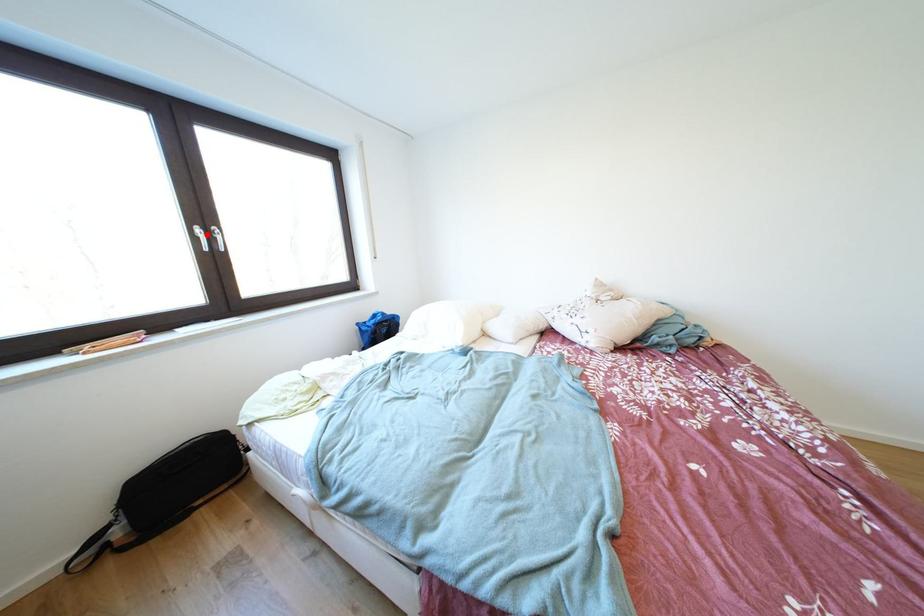
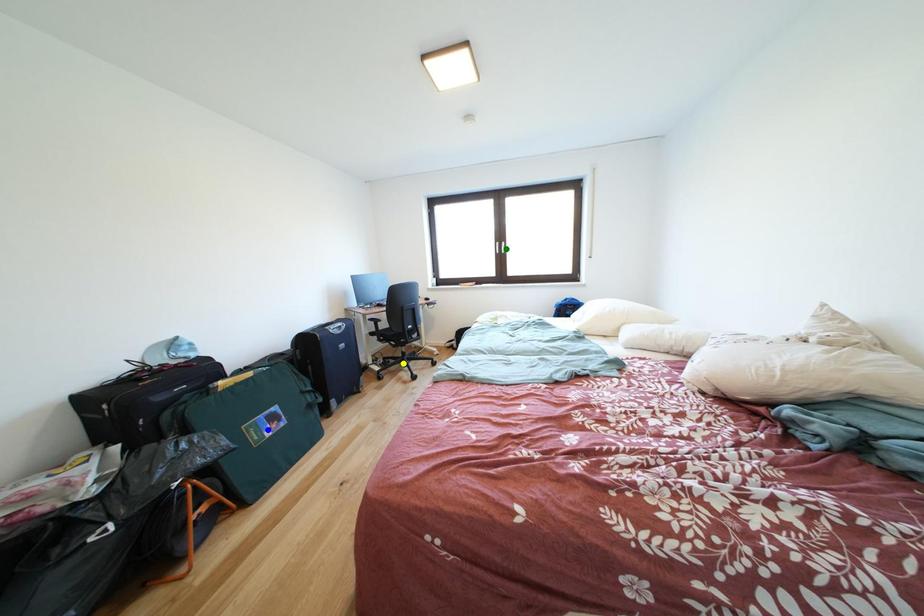
Question: I am providing you with two images of the same scene from different viewpoints. A red point is marked on the first image. You are given multiple points on the second image. Which point in image 2 is actually the same real-world point as the red point in image 1?

Choices:
 (A) yellow point
 (B) green point
 (C) blue point

Answer: (B)